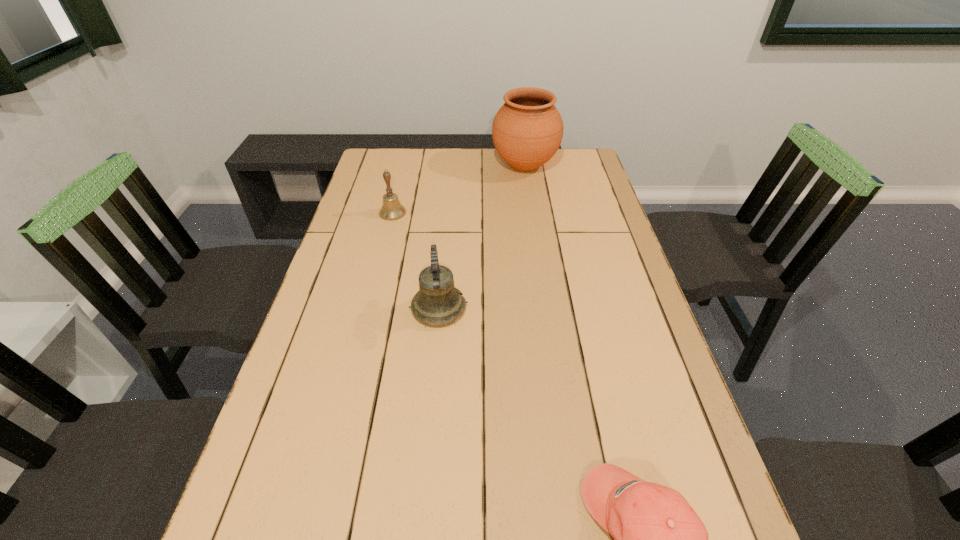
At what (x,y) coordinates should I click in order to perform the action: click on object that is at the left edge. Please return your answer as a coordinate pair (x, y). The image size is (960, 540). Looking at the image, I should click on (391, 209).

This screenshot has height=540, width=960. I want to click on object present at the right edge, so click(527, 131).

Locate an element on the screen. This screenshot has height=540, width=960. object that is positioned at the far right corner is located at coordinates (527, 131).

Where is `vacant point at the left edge`? vacant point at the left edge is located at coordinates (349, 227).

In the image, there is a desktop. At what (x,y) coordinates should I click in order to perform the action: click on vacant region at the right edge. Please return your answer as a coordinate pair (x, y). Image resolution: width=960 pixels, height=540 pixels. Looking at the image, I should click on (658, 332).

In the image, there is a desktop. Where is `vacant space at the far left corner`? This screenshot has height=540, width=960. vacant space at the far left corner is located at coordinates (380, 177).

At what (x,y) coordinates should I click in order to perform the action: click on vacant space that's between the leftmost object and the pottery. Please return your answer as a coordinate pair (x, y). This screenshot has height=540, width=960. Looking at the image, I should click on (459, 189).

At what (x,y) coordinates should I click in order to perform the action: click on free spot between the farthest object and the nearer bell. Please return your answer as a coordinate pair (x, y). This screenshot has height=540, width=960. Looking at the image, I should click on (482, 237).

I want to click on free spot between the second nearest object and the third nearest object, so click(x=416, y=261).

Where is `free space between the second farthest object and the right bell`? free space between the second farthest object and the right bell is located at coordinates (416, 261).